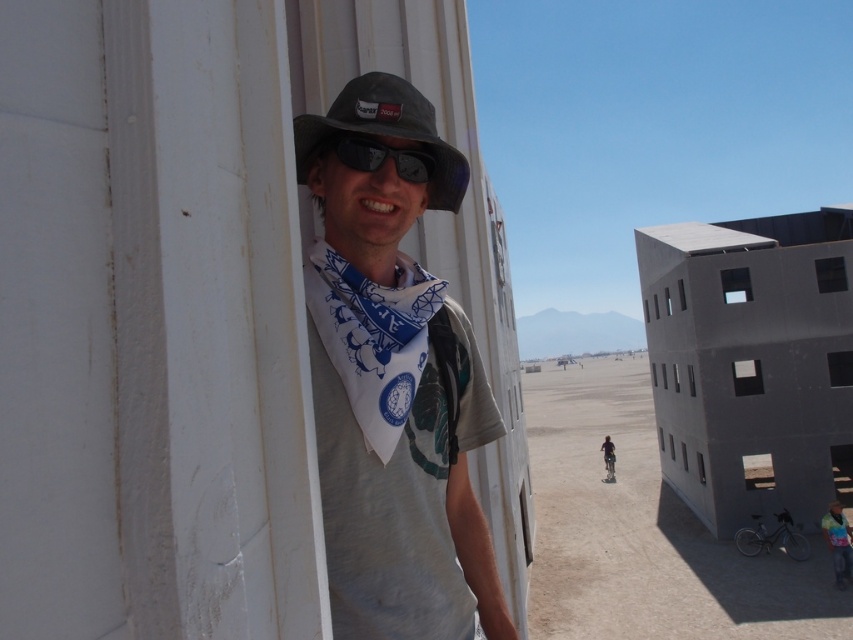
Question: Which of the following is the closest to the observer?

Choices:
 (A) (410, 317)
 (B) (386, 134)
 (C) (608, 470)
 (D) (405, 358)

Answer: (D)

Question: Is white cotton bandana at center bigger than white printed scarf at center?

Choices:
 (A) yes
 (B) no

Answer: (A)

Question: Which point appears closest to the camera in this image?

Choices:
 (A) (297, 129)
 (B) (396, 372)
 (C) (360, 164)
 (D) (610, 456)

Answer: (B)

Question: Is white cotton bandana at center to the right of matte black hat at center from the viewer's perspective?

Choices:
 (A) no
 (B) yes

Answer: (B)

Question: Which point is closer to the camera?

Choices:
 (A) white printed scarf at center
 (B) matte black hat at center
 (C) white cotton bandana at center
 (D) matte gray shirt at center

Answer: (B)

Question: Does matte black hat at center appear under matte gray shirt at center?

Choices:
 (A) no
 (B) yes

Answer: (A)